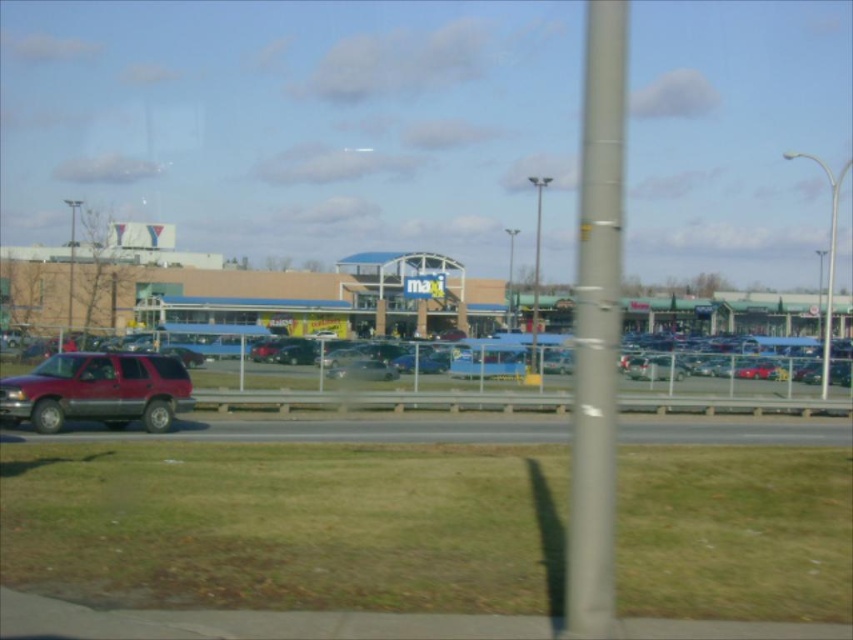
Question: Among these objects, which one is nearest to the camera?

Choices:
 (A) gray asphalt highway at lower center
 (B) metallic silver cars at center

Answer: (B)

Question: Does beige brick mall at center come behind shiny maroon suv at left?

Choices:
 (A) yes
 (B) no

Answer: (A)

Question: Which object is the farthest from the shiny maroon suv at left?

Choices:
 (A) gray asphalt highway at lower center
 (B) beige brick mall at center
 (C) metallic pole at center

Answer: (B)

Question: Can you confirm if metallic silver cars at center is wider than metallic pole at center?

Choices:
 (A) yes
 (B) no

Answer: (A)

Question: Does beige brick mall at center have a larger size compared to metallic silver cars at center?

Choices:
 (A) no
 (B) yes

Answer: (B)

Question: Which point is closer to the camera taking this photo?

Choices:
 (A) pyautogui.click(x=293, y=435)
 (B) pyautogui.click(x=28, y=284)
 (C) pyautogui.click(x=189, y=428)

Answer: (A)